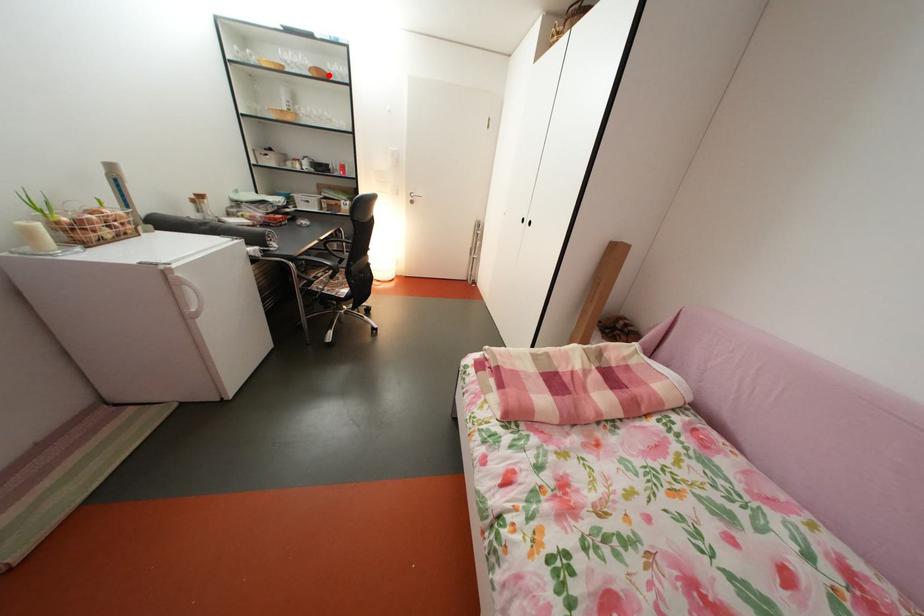
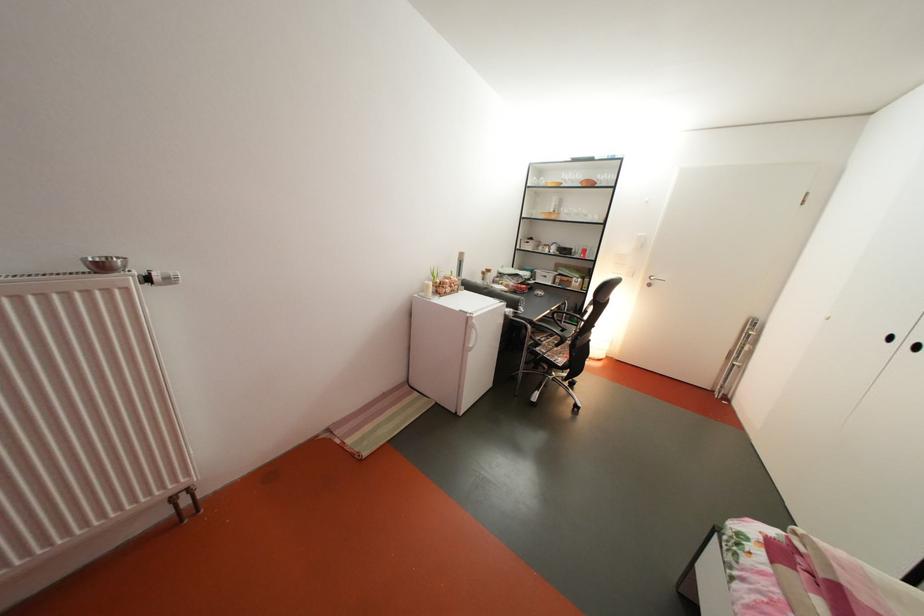
Locate, in the second image, the point that corresponds to the highlighted location in the first image.

(600, 187)